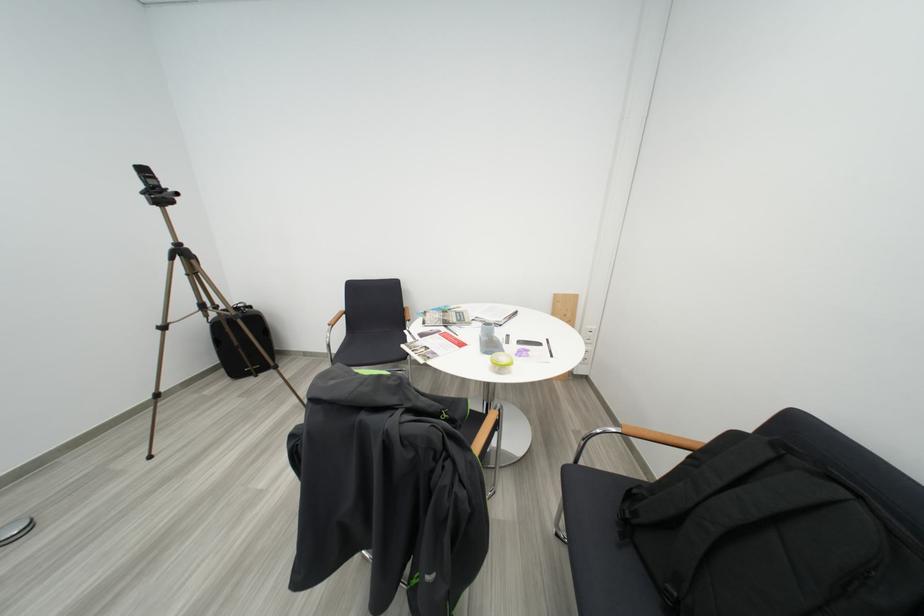
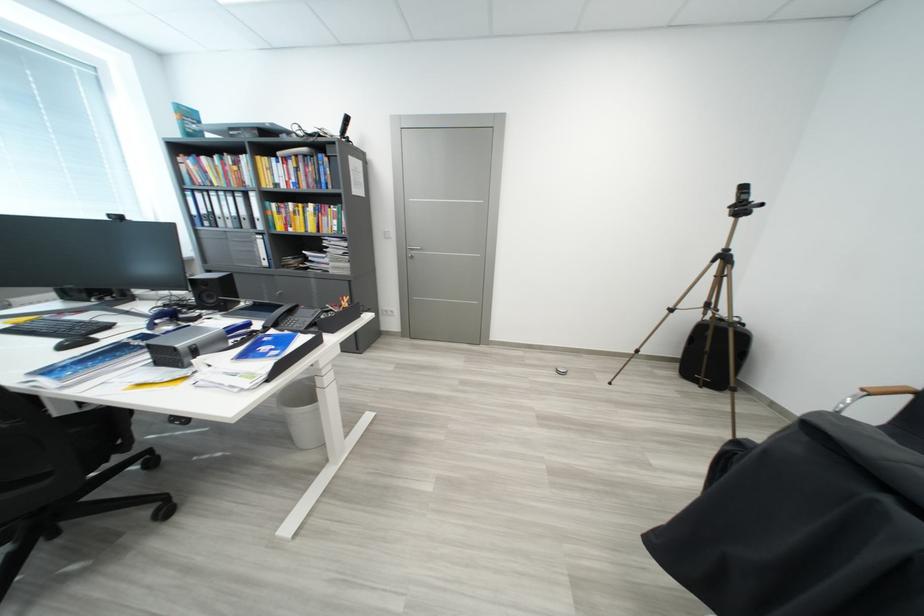
In the second image, find the point that corresponds to (341,328) in the first image.

(879, 395)